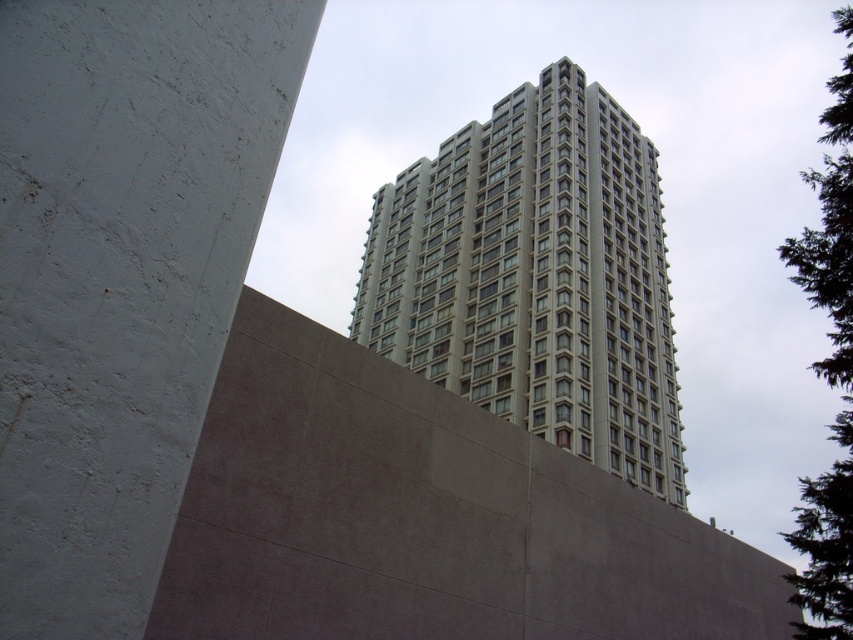
Question: Is gray concrete building at upper center to the left of green textured tree at upper right from the viewer's perspective?

Choices:
 (A) no
 (B) yes

Answer: (B)

Question: Which object appears farthest from the camera in this image?

Choices:
 (A) green textured tree at upper right
 (B) gray concrete building at upper center

Answer: (B)

Question: Is gray concrete building at upper center to the right of green textured tree at upper right from the viewer's perspective?

Choices:
 (A) yes
 (B) no

Answer: (B)

Question: Can you confirm if gray concrete building at upper center is positioned to the right of green textured tree at upper right?

Choices:
 (A) yes
 (B) no

Answer: (B)